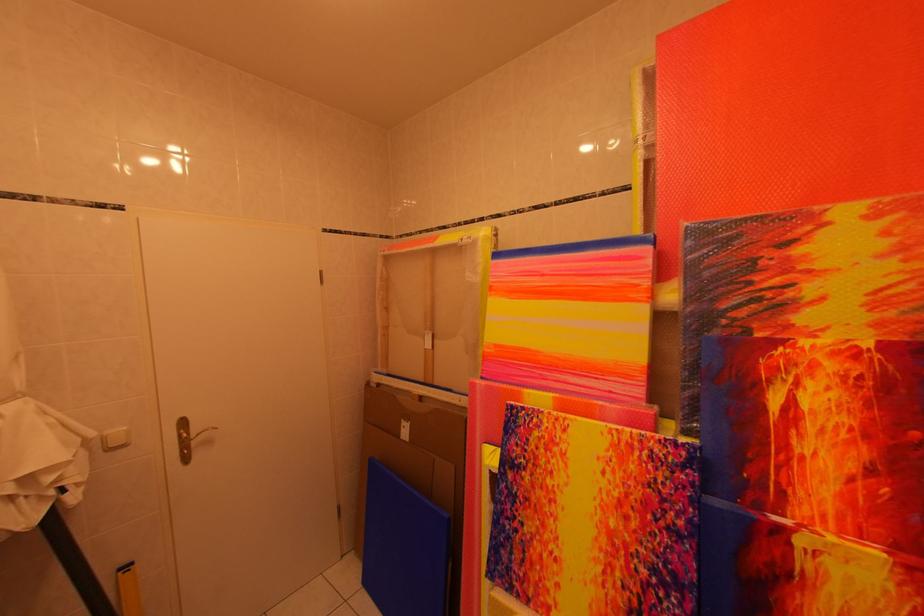
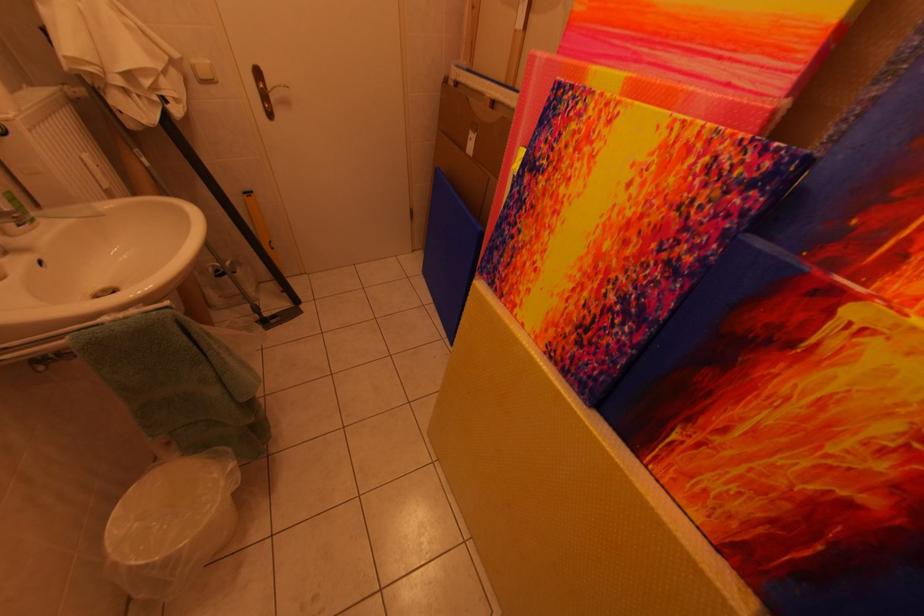
The point at (116,437) is marked in the first image. Where is the corresponding point in the second image?

(203, 65)